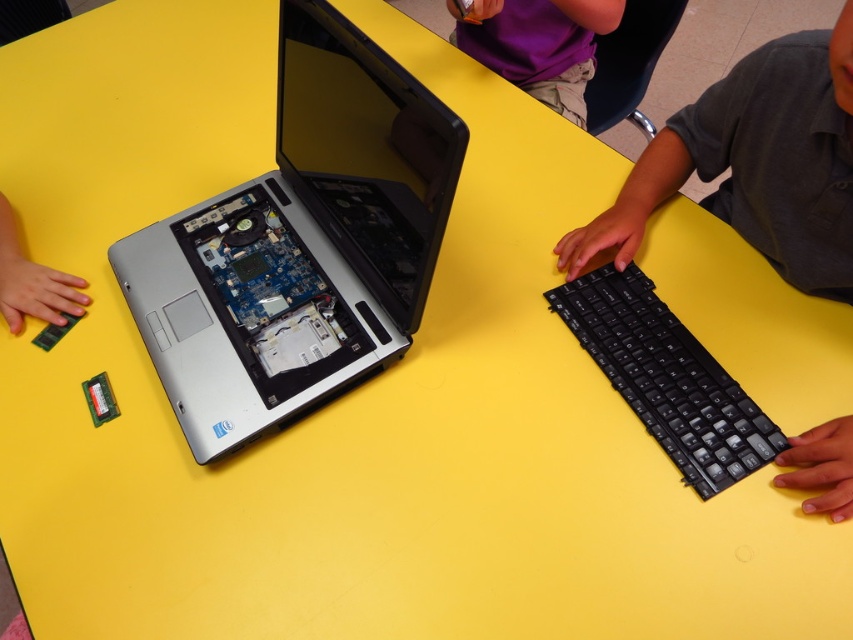
You are trying to place the black plastic keyboard at right back onto the silver metallic laptop at center. Based on their widths, will the keyboard fit properly on the laptop?

The silver metallic laptop at center is wider than the black plastic keyboard at right, so the keyboard will fit properly on the laptop since it is narrower than the laptop.

You are a technician working on a laptop repair. You need to locate the keyboard and the shirt in the image. According to the scene, where is the black plastic keyboard at right in relation to the purple fabric shirt at upper center?

The black plastic keyboard at right is below the purple fabric shirt at upper center.

You are a technician trying to place the black plastic keyboard at right back onto the silver metallic laptop at center. Can you determine if the keyboard will fit based on their sizes?

The silver metallic laptop at center is taller than the black plastic keyboard at right, so the keyboard should fit as it is shorter in height compared to the laptop.